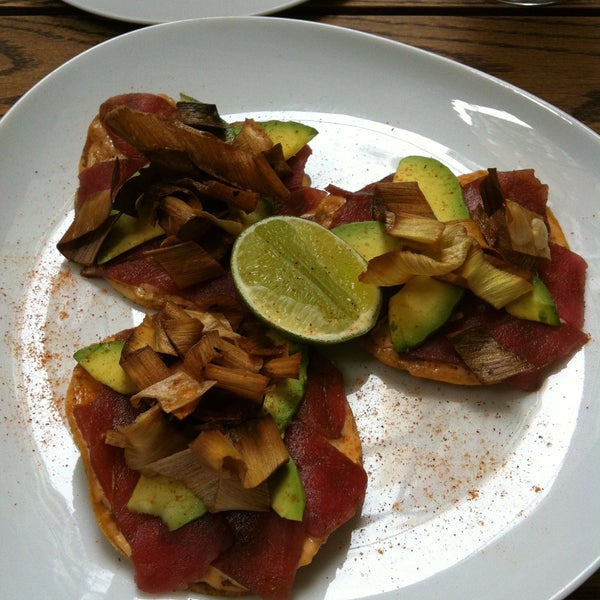
At what (x,y) coordinates should I click in order to perform the action: click on table. Please return your answer as a coordinate pair (x, y). Looking at the image, I should click on (560, 51), (63, 36), (593, 589).